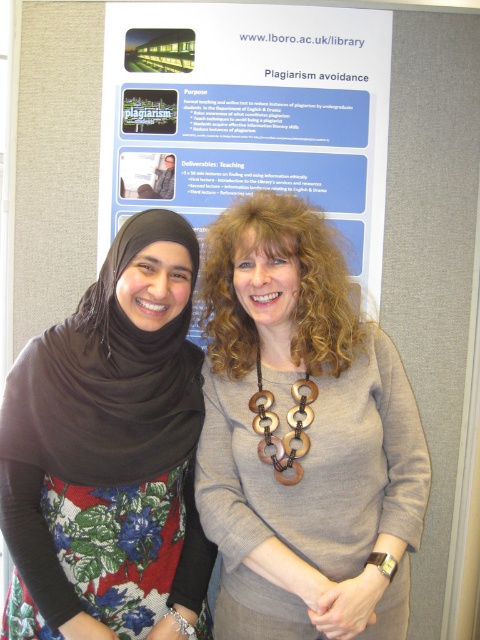
Who is taller, floral fabric dress at center or blue paper at upper center?

Standing taller between the two is floral fabric dress at center.

What do you see at coordinates (109, 452) in the screenshot? I see `floral fabric dress at center` at bounding box center [109, 452].

Between point (85, 433) and point (387, 38), which one is positioned in front?

Point (85, 433) is more forward.

Where is `floral fabric dress at center`? floral fabric dress at center is located at coordinates pos(109,452).

Does matte gray sweater at center appear on the right side of wooden rings at center?

Correct, you'll find matte gray sweater at center to the right of wooden rings at center.

Who is lower down, matte gray sweater at center or wooden rings at center?

matte gray sweater at center

Which is in front, point (391, 410) or point (308, 394)?

Positioned in front is point (308, 394).

This screenshot has width=480, height=640. Find the location of `matte gray sweater at center`. matte gray sweater at center is located at coordinates (302, 436).

Is point (300, 307) farther from viewer compared to point (377, 132)?

No, it is in front of (377, 132).

Is point (324, 388) positioned before point (266, 67)?

That is True.

I want to click on matte gray sweater at center, so click(x=302, y=436).